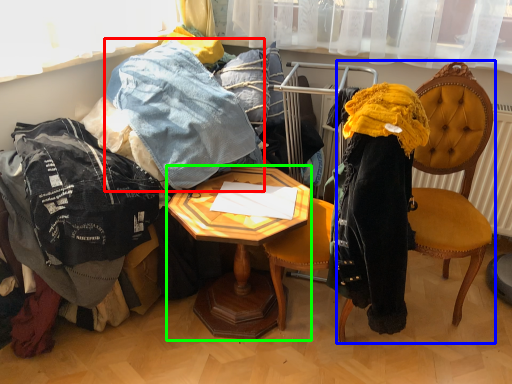
Question: Estimate the real-world distances between objects in this image. Which object is farther from trousers (highlighted by a red box), chair (highlighted by a blue box) or desk (highlighted by a green box)?

Choices:
 (A) chair
 (B) desk

Answer: (A)